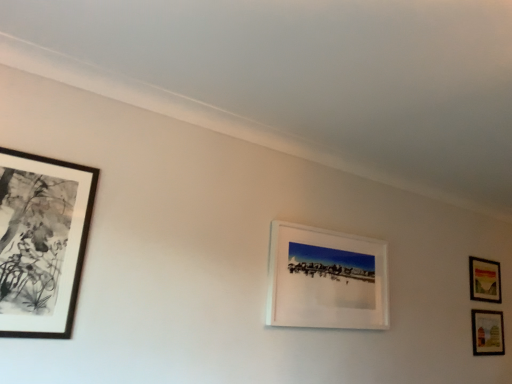
Image resolution: width=512 pixels, height=384 pixels. Identify the location of matte wooden picture frame at lower right, acting as the 2th picture frame starting from the right. (487, 332).

In order to face white matte picture frame at center, the 3th picture frame in the right-to-left sequence, should I rotate leftwards or rightwards?

It's best to rotate right around 10.417 degrees.

Find the location of `white matte picture frame at center, which is the 2th picture frame from left to right`. white matte picture frame at center, which is the 2th picture frame from left to right is located at coordinates (326, 279).

The image size is (512, 384). What do you see at coordinates (485, 280) in the screenshot? I see `matte wooden picture frame at lower right, the fourth picture frame in the front-to-back sequence` at bounding box center [485, 280].

Image resolution: width=512 pixels, height=384 pixels. Identify the location of matte wooden picture frame at lower right, acting as the 2th picture frame starting from the right. (487, 332).

Is the surface of black matte picture frame at left, placed as the first picture frame when sorted from front to back, in direct contact with matte wooden picture frame at lower right, the second picture frame in the back-to-front sequence?

No, black matte picture frame at left, placed as the first picture frame when sorted from front to back, is not making contact with matte wooden picture frame at lower right, the second picture frame in the back-to-front sequence.

Would you say black matte picture frame at left, which is the fourth picture frame in right-to-left order, is outside matte wooden picture frame at lower right, marked as the third picture frame in a left-to-right arrangement?

Yes, black matte picture frame at left, which is the fourth picture frame in right-to-left order, is located beyond the bounds of matte wooden picture frame at lower right, marked as the third picture frame in a left-to-right arrangement.

Can you confirm if black matte picture frame at left, placed as the first picture frame when sorted from front to back, is wider than matte wooden picture frame at lower right, the second picture frame in the back-to-front sequence?

Yes, black matte picture frame at left, placed as the first picture frame when sorted from front to back, is wider than matte wooden picture frame at lower right, the second picture frame in the back-to-front sequence.

Could you tell me if black matte picture frame at left, placed as the first picture frame when sorted from front to back, is facing matte wooden picture frame at lower right, the second picture frame in the back-to-front sequence?

No, black matte picture frame at left, placed as the first picture frame when sorted from front to back, does not turn towards matte wooden picture frame at lower right, the second picture frame in the back-to-front sequence.

Which is more to the right, matte wooden picture frame at lower right, marked as the third picture frame in a left-to-right arrangement, or white matte picture frame at center, which is the 2th picture frame from left to right?

Positioned to the right is matte wooden picture frame at lower right, marked as the third picture frame in a left-to-right arrangement.

Which is correct: matte wooden picture frame at lower right, marked as the third picture frame in a left-to-right arrangement, is inside white matte picture frame at center, the 3th picture frame in the right-to-left sequence, or outside of it?

matte wooden picture frame at lower right, marked as the third picture frame in a left-to-right arrangement, exists outside the volume of white matte picture frame at center, the 3th picture frame in the right-to-left sequence.

From the picture: Is matte wooden picture frame at lower right, the second picture frame in the back-to-front sequence, positioned with its back to white matte picture frame at center, which is counted as the second picture frame, starting from the front?

matte wooden picture frame at lower right, the second picture frame in the back-to-front sequence, is not turned away from white matte picture frame at center, which is counted as the second picture frame, starting from the front.

Is matte wooden picture frame at lower right, arranged as the first picture frame when viewed from the back, facing towards black matte picture frame at left, the first picture frame viewed from the left?

No, matte wooden picture frame at lower right, arranged as the first picture frame when viewed from the back, does not turn towards black matte picture frame at left, the first picture frame viewed from the left.

Does matte wooden picture frame at lower right, which is the 4th picture frame from left to right, appear on the left side of black matte picture frame at left, which ranks as the fourth picture frame in back-to-front order?

No.

Considering the positions of point (481, 292) and point (83, 230), is point (481, 292) closer or farther from the camera than point (83, 230)?

Point (481, 292) appears to be farther away from the viewer than point (83, 230).

Is matte wooden picture frame at lower right, which is counted as the 1th picture frame, starting from the right, taller or shorter than black matte picture frame at left, which ranks as the fourth picture frame in back-to-front order?

Clearly, matte wooden picture frame at lower right, which is counted as the 1th picture frame, starting from the right, is shorter compared to black matte picture frame at left, which ranks as the fourth picture frame in back-to-front order.

Which is behind, point (21, 201) or point (278, 302)?

The point (278, 302) is more distant.

Who is smaller, black matte picture frame at left, which ranks as the fourth picture frame in back-to-front order, or white matte picture frame at center, which is counted as the second picture frame, starting from the front?

white matte picture frame at center, which is counted as the second picture frame, starting from the front.

Is black matte picture frame at left, placed as the first picture frame when sorted from front to back, facing away from white matte picture frame at center, which is the 2th picture frame from left to right?

No.

Considering the positions of point (345, 252) and point (500, 281), is point (345, 252) closer or farther from the camera than point (500, 281)?

Point (345, 252).

Can you tell me how much white matte picture frame at center, which is counted as the second picture frame, starting from the front, and matte wooden picture frame at lower right, the fourth picture frame in the front-to-back sequence, differ in facing direction?

3.06 degrees.

Is matte wooden picture frame at lower right, the fourth picture frame in the front-to-back sequence, at the back of white matte picture frame at center, which is the 2th picture frame from left to right?

That's not correct — white matte picture frame at center, which is the 2th picture frame from left to right, is not looking away from matte wooden picture frame at lower right, the fourth picture frame in the front-to-back sequence.

In terms of width, does white matte picture frame at center, which is the 2th picture frame from left to right, look wider or thinner when compared to matte wooden picture frame at lower right, the fourth picture frame in the front-to-back sequence?

Considering their sizes, white matte picture frame at center, which is the 2th picture frame from left to right, looks broader than matte wooden picture frame at lower right, the fourth picture frame in the front-to-back sequence.

From the image's perspective, is white matte picture frame at center, the 3th picture frame in the right-to-left sequence, on black matte picture frame at left, placed as the first picture frame when sorted from front to back?

Actually, white matte picture frame at center, the 3th picture frame in the right-to-left sequence, appears below black matte picture frame at left, placed as the first picture frame when sorted from front to back, in the image.

The width and height of the screenshot is (512, 384). There is a black matte picture frame at left, which is the fourth picture frame in right-to-left order. In order to click on the 1st picture frame below it (from the image's perspective) in this screenshot , I will do `click(326, 279)`.

Is white matte picture frame at center, which is counted as the second picture frame, starting from the front, closer to the viewer compared to black matte picture frame at left, placed as the first picture frame when sorted from front to back?

That is False.

Is point (320, 284) farther from viewer compared to point (19, 258)?

That is True.

Are black matte picture frame at left, the first picture frame viewed from the left, and matte wooden picture frame at lower right, the fourth picture frame in the front-to-back sequence, far apart?

Yes, black matte picture frame at left, the first picture frame viewed from the left, and matte wooden picture frame at lower right, the fourth picture frame in the front-to-back sequence, are quite far apart.

In the image, is black matte picture frame at left, which ranks as the fourth picture frame in back-to-front order, positioned in front of or behind matte wooden picture frame at lower right, the fourth picture frame in the front-to-back sequence?

black matte picture frame at left, which ranks as the fourth picture frame in back-to-front order, is positioned closer to the viewer than matte wooden picture frame at lower right, the fourth picture frame in the front-to-back sequence.

Is black matte picture frame at left, the first picture frame viewed from the left, thinner than matte wooden picture frame at lower right, arranged as the first picture frame when viewed from the back?

In fact, black matte picture frame at left, the first picture frame viewed from the left, might be wider than matte wooden picture frame at lower right, arranged as the first picture frame when viewed from the back.

Considering the relative positions of black matte picture frame at left, the first picture frame viewed from the left, and matte wooden picture frame at lower right, arranged as the first picture frame when viewed from the back, in the image provided, is black matte picture frame at left, the first picture frame viewed from the left, to the right of matte wooden picture frame at lower right, arranged as the first picture frame when viewed from the back, from the viewer's perspective?

No, black matte picture frame at left, the first picture frame viewed from the left, is not to the right of matte wooden picture frame at lower right, arranged as the first picture frame when viewed from the back.

From the image's perspective, count 3rd picture frames downward from the black matte picture frame at left, the first picture frame viewed from the left, and point to it. Please provide its 2D coordinates.

[(487, 332)]

At what (x,y) coordinates should I click in order to perform the action: click on picture frame that is the 2nd object above the matte wooden picture frame at lower right, acting as the 2th picture frame starting from the right (from a real-world perspective). Please return your answer as a coordinate pair (x, y). Looking at the image, I should click on (326, 279).

Estimate the real-world distances between objects in this image. Which object is closer to matte wooden picture frame at lower right, which is counted as the 1th picture frame, starting from the right, black matte picture frame at left, placed as the first picture frame when sorted from front to back, or white matte picture frame at center, which is the third picture frame in back-to-front order?

white matte picture frame at center, which is the third picture frame in back-to-front order, is positioned closer to the anchor matte wooden picture frame at lower right, which is counted as the 1th picture frame, starting from the right.

Based on their spatial positions, is white matte picture frame at center, which is counted as the second picture frame, starting from the front, or matte wooden picture frame at lower right, marked as the third picture frame in a left-to-right arrangement, further from matte wooden picture frame at lower right, the fourth picture frame in the front-to-back sequence?

white matte picture frame at center, which is counted as the second picture frame, starting from the front.

Based on their spatial positions, is matte wooden picture frame at lower right, positioned as the 3th picture frame in front-to-back order, or matte wooden picture frame at lower right, which is the 4th picture frame from left to right, closer to white matte picture frame at center, which is counted as the second picture frame, starting from the front?

Based on the image, matte wooden picture frame at lower right, which is the 4th picture frame from left to right, appears to be nearer to white matte picture frame at center, which is counted as the second picture frame, starting from the front.

Estimate the real-world distances between objects in this image. Which object is closer to matte wooden picture frame at lower right, the second picture frame in the back-to-front sequence, black matte picture frame at left, which is the fourth picture frame in right-to-left order, or matte wooden picture frame at lower right, which is counted as the 1th picture frame, starting from the right?

matte wooden picture frame at lower right, which is counted as the 1th picture frame, starting from the right.

Based on their spatial positions, is matte wooden picture frame at lower right, which is counted as the 1th picture frame, starting from the right, or white matte picture frame at center, which is the 2th picture frame from left to right, further from black matte picture frame at left, the first picture frame viewed from the left?

matte wooden picture frame at lower right, which is counted as the 1th picture frame, starting from the right, lies further to black matte picture frame at left, the first picture frame viewed from the left, than the other object.

When comparing their distances from matte wooden picture frame at lower right, the fourth picture frame in the front-to-back sequence, does matte wooden picture frame at lower right, the second picture frame in the back-to-front sequence, or white matte picture frame at center, which is the 2th picture frame from left to right, seem further?

white matte picture frame at center, which is the 2th picture frame from left to right.

Estimate the real-world distances between objects in this image. Which object is further from white matte picture frame at center, the 3th picture frame in the right-to-left sequence, matte wooden picture frame at lower right, which is counted as the 1th picture frame, starting from the right, or matte wooden picture frame at lower right, acting as the 2th picture frame starting from the right?

Based on the image, matte wooden picture frame at lower right, acting as the 2th picture frame starting from the right, appears to be further to white matte picture frame at center, the 3th picture frame in the right-to-left sequence.

From the image, which object appears to be farther from white matte picture frame at center, which is counted as the second picture frame, starting from the front, black matte picture frame at left, placed as the first picture frame when sorted from front to back, or matte wooden picture frame at lower right, acting as the 2th picture frame starting from the right?

matte wooden picture frame at lower right, acting as the 2th picture frame starting from the right, is positioned further to the anchor white matte picture frame at center, which is counted as the second picture frame, starting from the front.

Find the location of a particular element. The height and width of the screenshot is (384, 512). picture frame situated between black matte picture frame at left, the first picture frame viewed from the left, and matte wooden picture frame at lower right, marked as the third picture frame in a left-to-right arrangement, from left to right is located at coordinates pos(326,279).

Where is `picture frame between white matte picture frame at center, which is the third picture frame in back-to-front order, and matte wooden picture frame at lower right, which is the 4th picture frame from left to right, from left to right`? This screenshot has height=384, width=512. picture frame between white matte picture frame at center, which is the third picture frame in back-to-front order, and matte wooden picture frame at lower right, which is the 4th picture frame from left to right, from left to right is located at coordinates (487, 332).